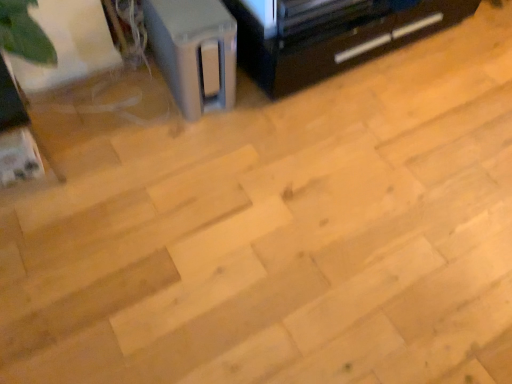
Find the location of a particular element. This screenshot has width=512, height=384. vacant area situated to the left side of satin gray speaker at upper left is located at coordinates 121,89.